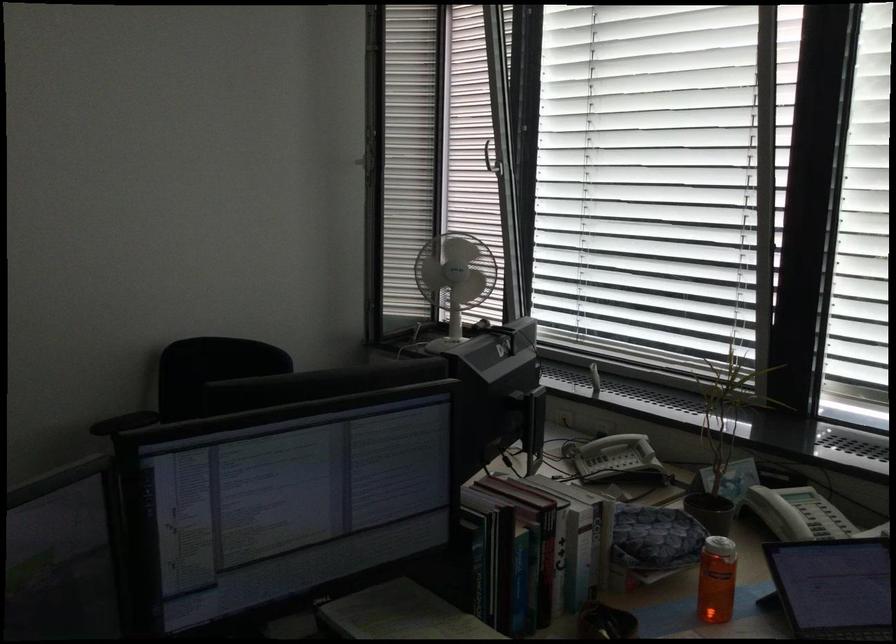
What do you see at coordinates (718, 545) in the screenshot? This screenshot has width=896, height=644. I see `the orange bottle cap` at bounding box center [718, 545].